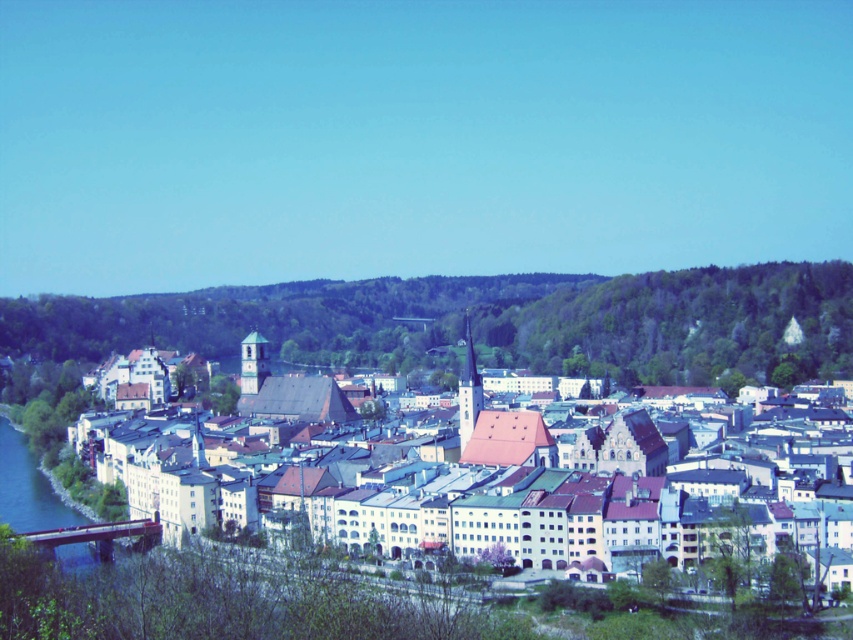
You are standing on the small bridge with a red railing and looking towards the town. You see the green leafy hillside at center and the matte stone buildings at center. Which one is located to the left side of the other?

The green leafy hillside at center is positioned on the left side of matte stone buildings at center, so the hillside is to the left of the buildings.

You are a tourist in the town and want to take a photo that includes both the green leafy hillside at center and the matte stone buildings at center. Which object will occupy more space in your photo?

The green leafy hillside at center will occupy more space in the photo since it has a larger size compared to the matte stone buildings at center.

You are standing at the point marked as point (485, 321) in the image. What is the name of the object located exactly at this coordinate?

The point (485, 321) corresponds to the green leafy hillside at center.